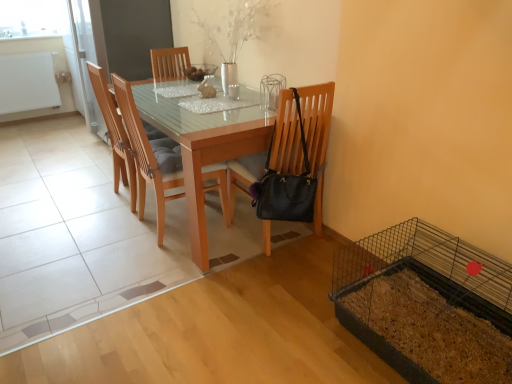
Question: Is wooden chair at center, which ranks as the second chair in left-to-right order, at the right side of black leather chair at center, acting as the 3th chair starting from the left?

Choices:
 (A) yes
 (B) no

Answer: (B)

Question: Is the depth of wooden chair at center, acting as the second chair starting from the right, greater than that of black leather chair at center, acting as the 3th chair starting from the left?

Choices:
 (A) yes
 (B) no

Answer: (A)

Question: From the image's perspective, would you say wooden chair at center, acting as the second chair starting from the right, is positioned over black leather chair at center, the first chair viewed from the right?

Choices:
 (A) no
 (B) yes

Answer: (B)

Question: From a real-world perspective, does wooden chair at center, which ranks as the second chair in left-to-right order, sit lower than black leather chair at center, acting as the 3th chair starting from the left?

Choices:
 (A) yes
 (B) no

Answer: (A)

Question: Is wooden chair at center, acting as the second chair starting from the right, taller than black leather chair at center, the first chair viewed from the right?

Choices:
 (A) no
 (B) yes

Answer: (A)

Question: Is point (287, 100) positioned closer to the camera than point (122, 129)?

Choices:
 (A) farther
 (B) closer

Answer: (B)

Question: Considering the positions of black leather chair at center, the first chair viewed from the right, and wooden chair at center, which is counted as the 3th chair, starting from the right, in the image, is black leather chair at center, the first chair viewed from the right, bigger or smaller than wooden chair at center, which is counted as the 3th chair, starting from the right,?

Choices:
 (A) small
 (B) big

Answer: (A)

Question: Considering the positions of black leather chair at center, acting as the 3th chair starting from the left, and wooden chair at center, marked as the 1th chair in a left-to-right arrangement, in the image, is black leather chair at center, acting as the 3th chair starting from the left, wider or thinner than wooden chair at center, marked as the 1th chair in a left-to-right arrangement,?

Choices:
 (A) wide
 (B) thin

Answer: (A)

Question: Is black leather chair at center, the first chair viewed from the right, taller or shorter than wooden chair at center, which is counted as the 3th chair, starting from the right?

Choices:
 (A) short
 (B) tall

Answer: (B)

Question: From the image's perspective, is light brown wood table at center located above or below wooden chair at center, which ranks as the second chair in left-to-right order?

Choices:
 (A) above
 (B) below

Answer: (A)

Question: Based on their positions, is light brown wood table at center located to the left or right of wooden chair at center, acting as the second chair starting from the right?

Choices:
 (A) right
 (B) left

Answer: (A)

Question: Considering the positions of light brown wood table at center and wooden chair at center, which ranks as the second chair in left-to-right order, in the image, is light brown wood table at center taller or shorter than wooden chair at center, which ranks as the second chair in left-to-right order,?

Choices:
 (A) tall
 (B) short

Answer: (B)

Question: Considering the positions of light brown wood table at center and wooden chair at center, which ranks as the second chair in left-to-right order, in the image, is light brown wood table at center bigger or smaller than wooden chair at center, which ranks as the second chair in left-to-right order,?

Choices:
 (A) small
 (B) big

Answer: (B)

Question: Considering their positions, is light brown wood table at center located in front of or behind wooden chair at center, which is counted as the 3th chair, starting from the right?

Choices:
 (A) front
 (B) behind

Answer: (A)

Question: Considering the positions of light brown wood table at center and wooden chair at center, which is counted as the 3th chair, starting from the right, in the image, is light brown wood table at center taller or shorter than wooden chair at center, which is counted as the 3th chair, starting from the right,?

Choices:
 (A) tall
 (B) short

Answer: (B)